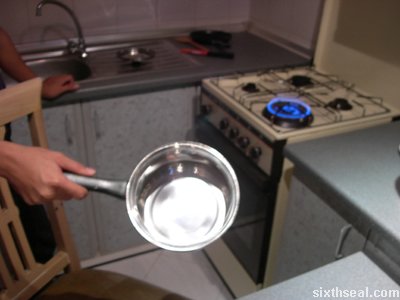
At what (x,y) coordinates should I click in order to perform the action: click on oven door. Please return your answer as a coordinate pair (x, y). Looking at the image, I should click on (250, 195).